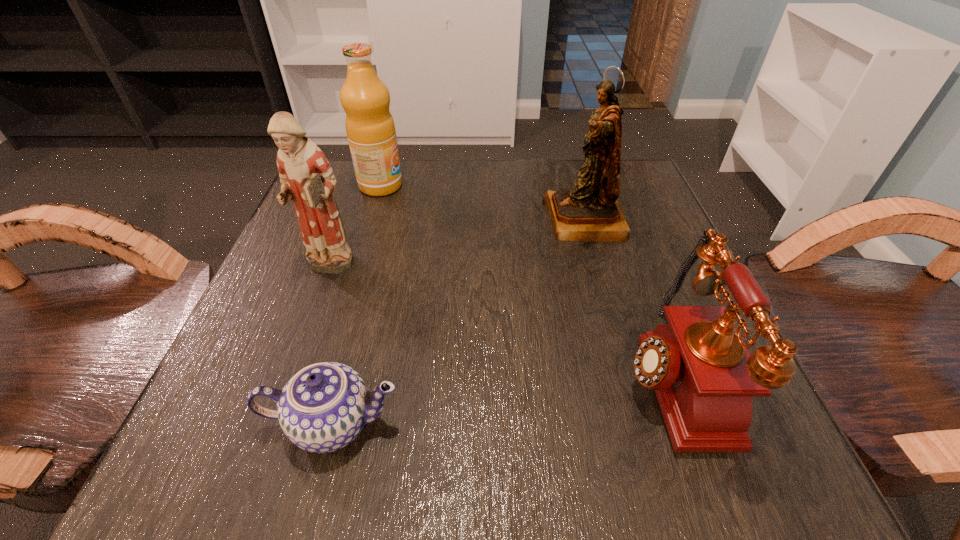
This screenshot has height=540, width=960. I want to click on the right figurine, so click(590, 212).

Locate an element on the screen. Image resolution: width=960 pixels, height=540 pixels. fruit juice is located at coordinates (370, 128).

I want to click on the left figurine, so click(307, 178).

Identify the location of the third nearest object. The image size is (960, 540). (307, 178).

Where is `the fourth tallest object`? The image size is (960, 540). the fourth tallest object is located at coordinates [x=704, y=377].

I want to click on chinaware, so click(322, 408).

I want to click on free location located 0.350m on the front-facing side of the farther figurine, so click(372, 220).

You are a GUI agent. You are given a task and a screenshot of the screen. Output one action in this format:
    pyautogui.click(x=<x>, y=<y>)
    Task: Click on the free space located on the front-facing side of the farther figurine
    The image size is (960, 540).
    Given the screenshot: What is the action you would take?
    pyautogui.click(x=421, y=220)

At what (x,y) coordinates should I click in order to perform the action: click on vacant area located 0.280m on the front-facing side of the farther figurine. Please return your answer as a coordinate pair (x, y). Looking at the image, I should click on (406, 220).

At what (x,y) coordinates should I click in order to perform the action: click on vacant space located 0.080m on the front label of the fruit juice. Please return your answer as a coordinate pair (x, y). Looking at the image, I should click on (439, 186).